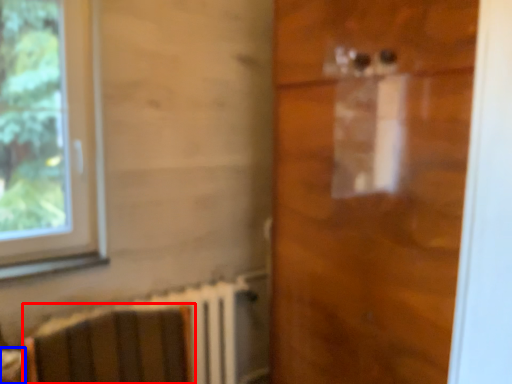
Question: Which of the following is the farthest to the observer, armchair (highlighted by a red box) or table (highlighted by a blue box)?

Choices:
 (A) armchair
 (B) table

Answer: (B)